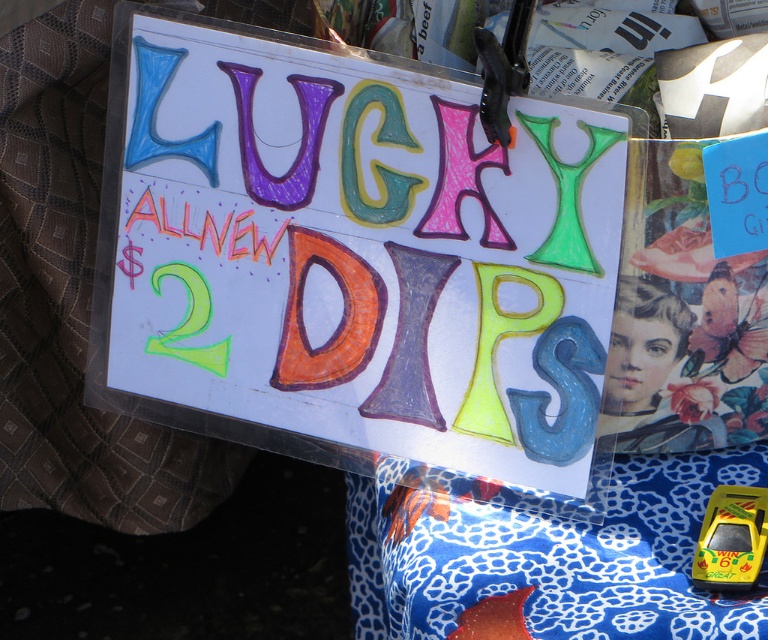
Question: Is hand-drawn paper sign at center thinner than yellow plastic toy car at center?

Choices:
 (A) no
 (B) yes

Answer: (A)

Question: In this image, where is hand-drawn paper sign at center located relative to yellow plastic toy car at center?

Choices:
 (A) above
 (B) below

Answer: (A)

Question: Which point is farther to the camera?

Choices:
 (A) (740, 540)
 (B) (358, 291)

Answer: (B)

Question: Where is hand-drawn paper sign at center located in relation to yellow plastic toy car at center in the image?

Choices:
 (A) above
 (B) below

Answer: (A)

Question: Which point is farther to the camera?

Choices:
 (A) yellow plastic toy car at center
 (B) hand-drawn paper sign at center

Answer: (B)